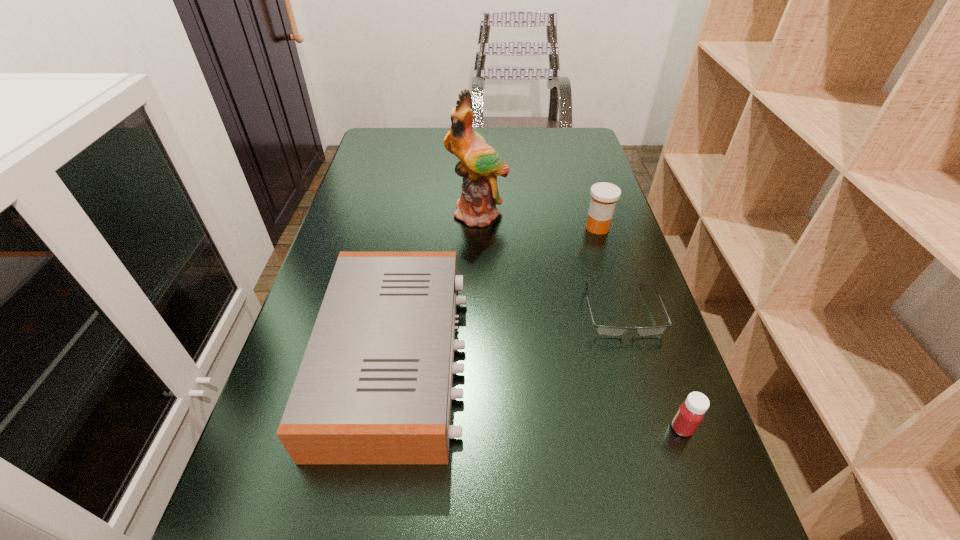
The width and height of the screenshot is (960, 540). Identify the location of object that is positioned at the left edge. (374, 386).

Locate an element on the screen. The width and height of the screenshot is (960, 540). spectacles located in the right edge section of the desktop is located at coordinates (604, 330).

This screenshot has height=540, width=960. In order to click on free spot at the far edge of the desktop in this screenshot , I will do `click(536, 127)`.

Find the location of a particular element. free space at the left edge is located at coordinates (355, 228).

In order to click on vacant space at the right edge of the desktop in this screenshot , I will do pyautogui.click(x=593, y=172).

The width and height of the screenshot is (960, 540). What are the coordinates of `vacant region at the far left corner` in the screenshot? It's located at (397, 127).

The image size is (960, 540). In the image, there is a desktop. What are the coordinates of `vacant space at the far right corner` in the screenshot? It's located at (588, 154).

Find the location of `free spot between the taller medicine and the radio receiver`. free spot between the taller medicine and the radio receiver is located at coordinates (496, 293).

Where is `vacant space that's between the shortest object and the radio receiver`? This screenshot has height=540, width=960. vacant space that's between the shortest object and the radio receiver is located at coordinates (509, 335).

At what (x,y) coordinates should I click in order to perform the action: click on free area in between the shorter medicine and the spectacles. Please return your answer as a coordinate pair (x, y). Looking at the image, I should click on (651, 369).